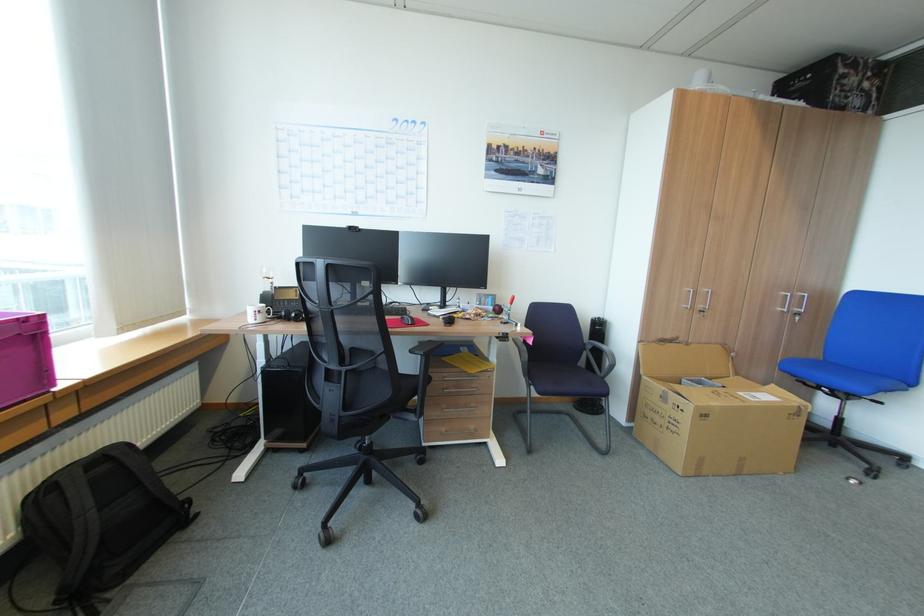
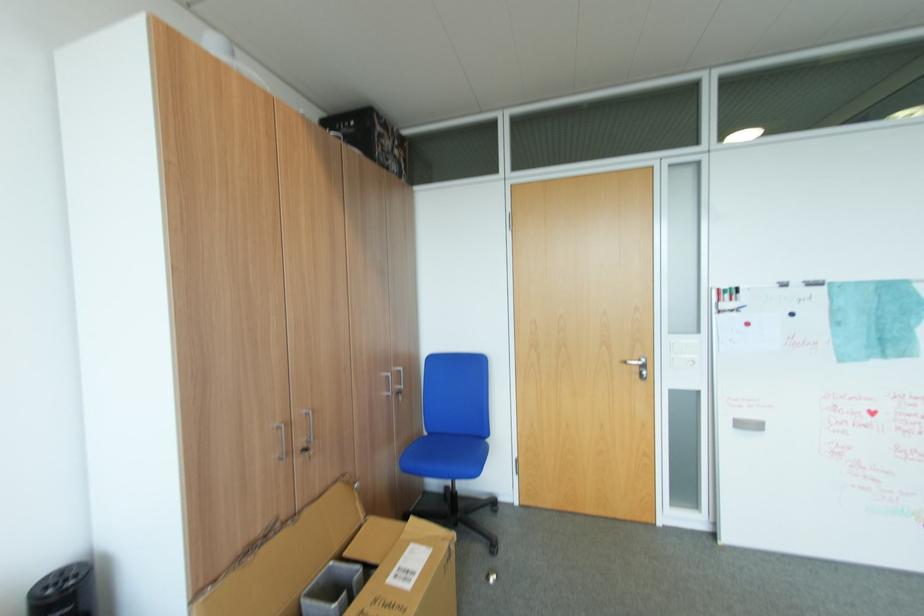
Find the pixel in the second image that matches pixel 708 310 in the first image.

(310, 451)